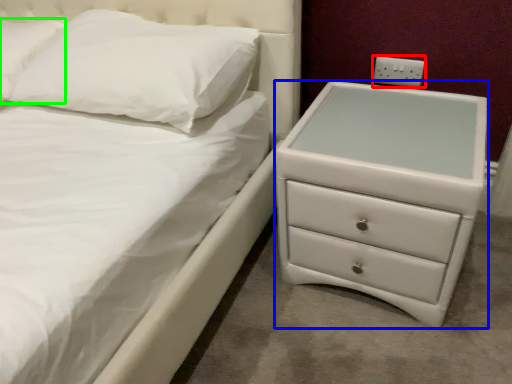
Question: Which object is the closest to the electric outlet (highlighted by a red box)? Choose among these: chest of drawers (highlighted by a blue box) or pillow (highlighted by a green box).

Choices:
 (A) chest of drawers
 (B) pillow

Answer: (A)